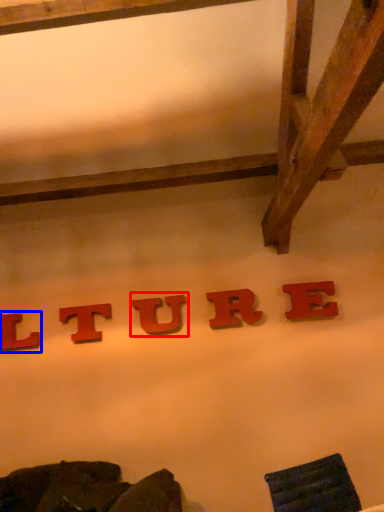
Question: Among these objects, which one is farthest to the camera, letter (highlighted by a red box) or letter (highlighted by a blue box)?

Choices:
 (A) letter
 (B) letter

Answer: (B)